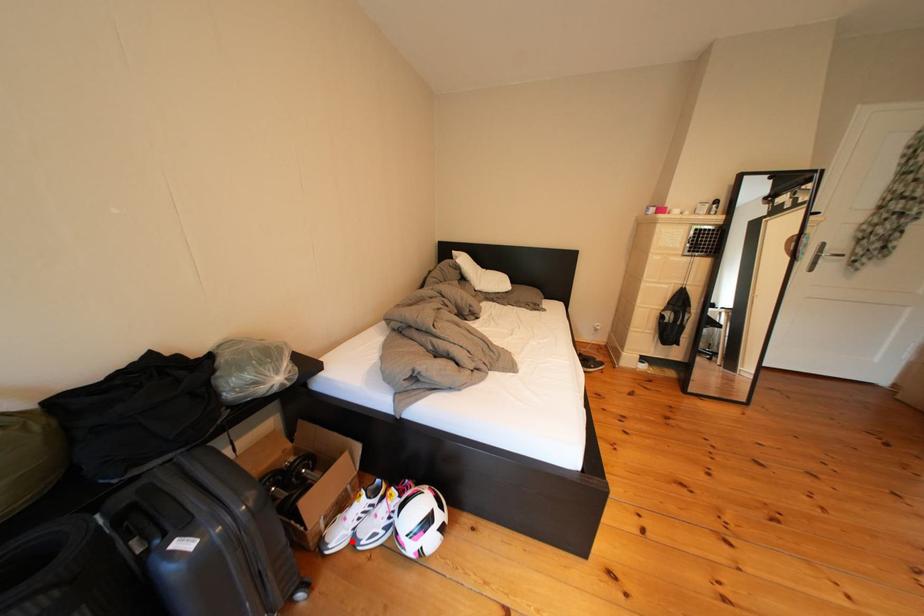
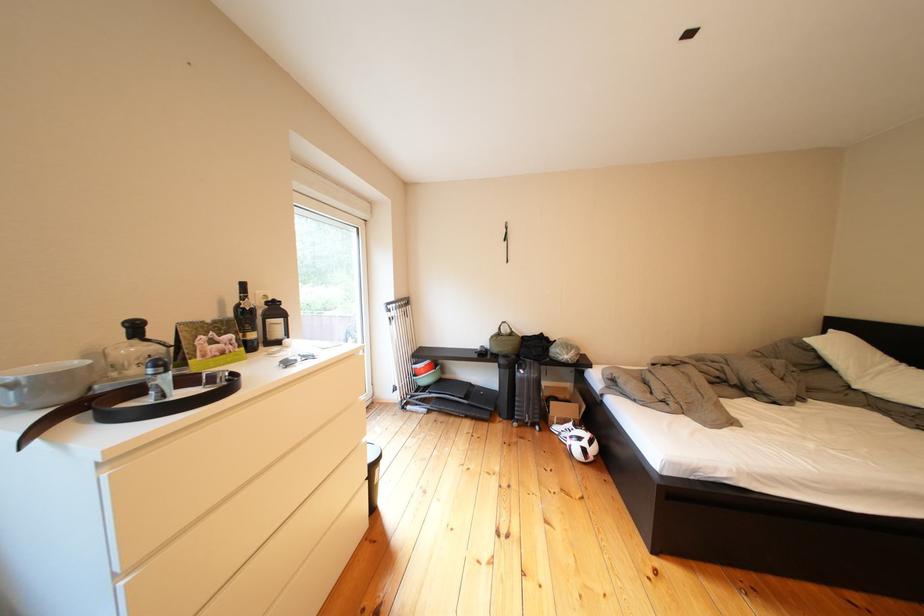
Question: I am providing you with two images of the same scene from different viewpoints. A red point is shown in image1. For the corresponding object point in image2, is it positioned nearer or farther from the camera?

Choices:
 (A) Nearer
 (B) Farther

Answer: (B)